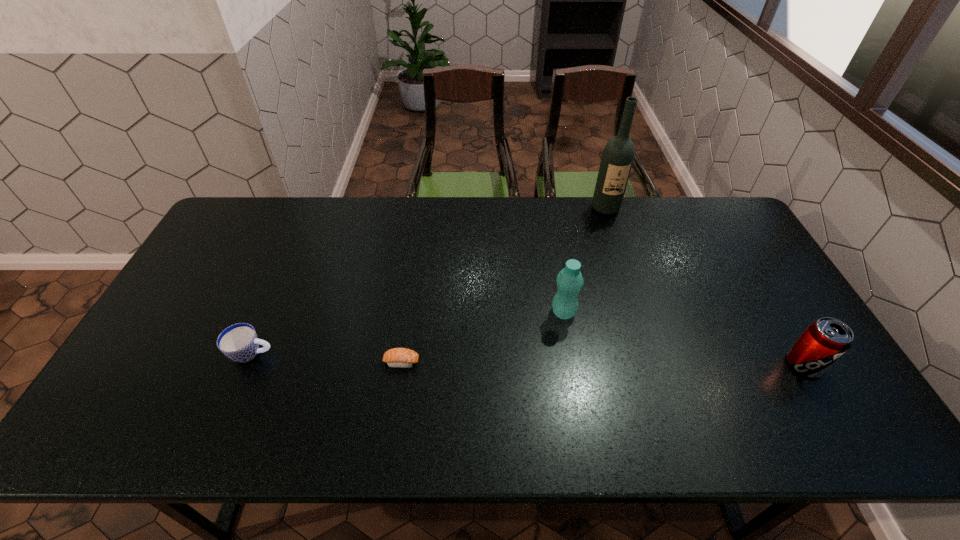
In order to click on the tallest object in this screenshot , I will do `click(617, 159)`.

Where is `wine bottle`? The width and height of the screenshot is (960, 540). wine bottle is located at coordinates (617, 159).

This screenshot has height=540, width=960. In order to click on the third object from right to left in this screenshot , I will do `click(569, 280)`.

Find the location of `the fourth shortest object`. the fourth shortest object is located at coordinates (569, 280).

I want to click on the third shortest object, so click(826, 340).

Identify the location of the rightmost object. (826, 340).

You are a GUI agent. You are given a task and a screenshot of the screen. Output one action in this format:
    pyautogui.click(x=<x>, y=<y>)
    Task: Click on the leftmost object
    
    Given the screenshot: What is the action you would take?
    pyautogui.click(x=239, y=342)

The height and width of the screenshot is (540, 960). What are the coordinates of `cup` in the screenshot? It's located at (239, 342).

What are the coordinates of `the shortest object` in the screenshot? It's located at (397, 357).

Locate an element on the screen. The width and height of the screenshot is (960, 540). sushi is located at coordinates (397, 357).